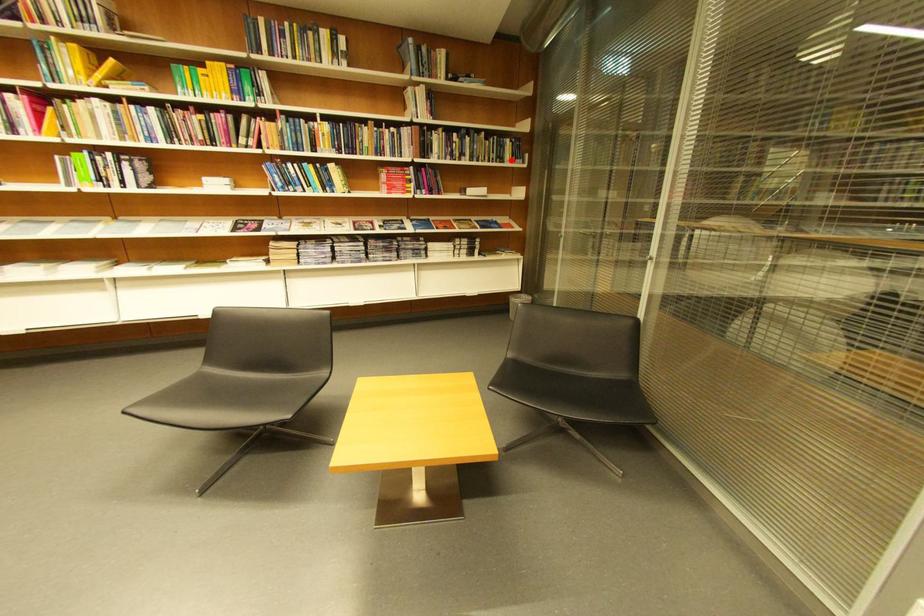
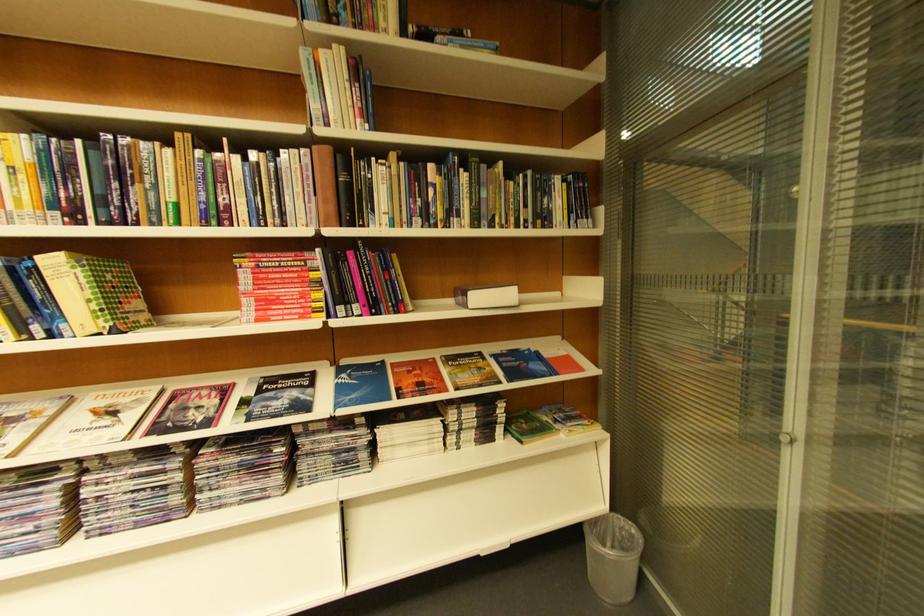
Question: A red point is marked in image1. In image2, is the corresponding 3D point closer to the camera or farther? Reply with the corresponding letter.

Choices:
 (A) The corresponding 3D point is closer.
 (B) The corresponding 3D point is farther.

Answer: (B)